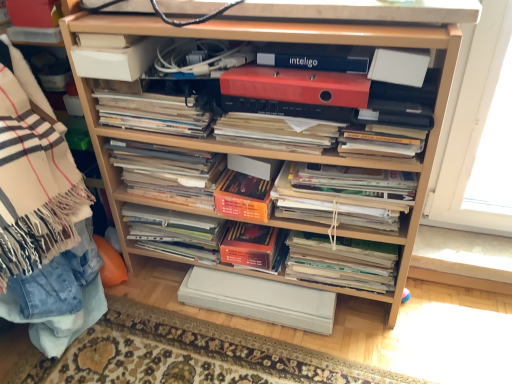
Where is `free space above matte black magazine at center, which is the second magazine from top to bottom (from a real-world perspective)`? Image resolution: width=512 pixels, height=384 pixels. free space above matte black magazine at center, which is the second magazine from top to bottom (from a real-world perspective) is located at coordinates (283, 114).